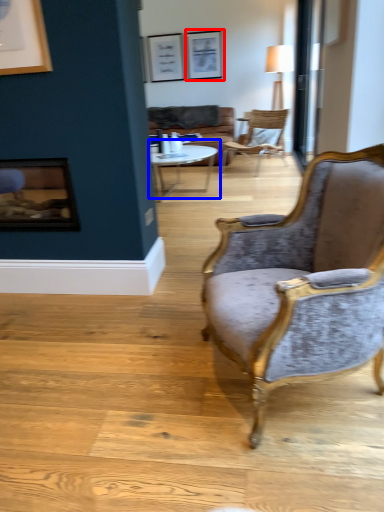
Question: Which object appears closest to the camera in this image, picture frame (highlighted by a red box) or coffee table (highlighted by a blue box)?

Choices:
 (A) picture frame
 (B) coffee table

Answer: (B)